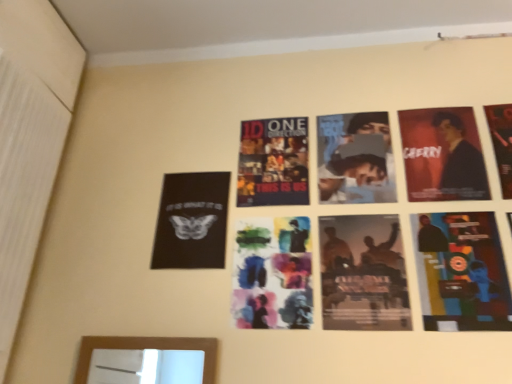
Question: Which direction should I rotate to face silhouette paper poster at center, which is the 3th poster in left-to-right order, — up or down?

Choices:
 (A) down
 (B) up

Answer: (A)

Question: From a real-world perspective, is silhouette paper poster at center, arranged as the third poster when viewed from the right, under matte black poster at upper right, the 1th poster from the right?

Choices:
 (A) yes
 (B) no

Answer: (A)

Question: From the image's perspective, is silhouette paper poster at center, which is the 3th poster in left-to-right order, under matte black poster at upper right, the 5th poster when ordered from left to right?

Choices:
 (A) yes
 (B) no

Answer: (A)

Question: Would you say silhouette paper poster at center, which is the 3th poster in left-to-right order, contains matte black poster at upper right, the 1th poster from the right?

Choices:
 (A) yes
 (B) no

Answer: (B)

Question: Is silhouette paper poster at center, arranged as the third poster when viewed from the right, looking in the opposite direction of matte black poster at upper right, the 1th poster from the right?

Choices:
 (A) no
 (B) yes

Answer: (A)

Question: Is silhouette paper poster at center, which is the 3th poster in left-to-right order, behind matte black poster at upper right, the 1th poster from the right?

Choices:
 (A) no
 (B) yes

Answer: (A)

Question: Is silhouette paper poster at center, arranged as the third poster when viewed from the right, positioned in front of matte black poster at upper right, the 5th poster when ordered from left to right?

Choices:
 (A) no
 (B) yes

Answer: (B)

Question: Is silhouette paper poster at center, which is the 3th poster in left-to-right order, not near multicolored paper collage at lower right, placed as the 2th poster when sorted from right to left?

Choices:
 (A) yes
 (B) no

Answer: (B)

Question: Does silhouette paper poster at center, arranged as the third poster when viewed from the right, turn towards multicolored paper collage at lower right, the fourth poster in the left-to-right sequence?

Choices:
 (A) no
 (B) yes

Answer: (A)

Question: Is silhouette paper poster at center, arranged as the third poster when viewed from the right, outside multicolored paper collage at lower right, placed as the 2th poster when sorted from right to left?

Choices:
 (A) yes
 (B) no

Answer: (A)

Question: From a real-world perspective, is silhouette paper poster at center, arranged as the third poster when viewed from the right, on multicolored paper collage at lower right, placed as the 2th poster when sorted from right to left?

Choices:
 (A) no
 (B) yes

Answer: (A)

Question: From a real-world perspective, is silhouette paper poster at center, which is the 3th poster in left-to-right order, under multicolored paper collage at lower right, the fourth poster in the left-to-right sequence?

Choices:
 (A) yes
 (B) no

Answer: (A)

Question: Is silhouette paper poster at center, which is the 3th poster in left-to-right order, further to camera compared to multicolored paper collage at lower right, placed as the 2th poster when sorted from right to left?

Choices:
 (A) no
 (B) yes

Answer: (B)

Question: From the image's perspective, is silhouette paper poster at center, arranged as the third poster when viewed from the right, located beneath matte black suit at upper right?

Choices:
 (A) yes
 (B) no

Answer: (A)